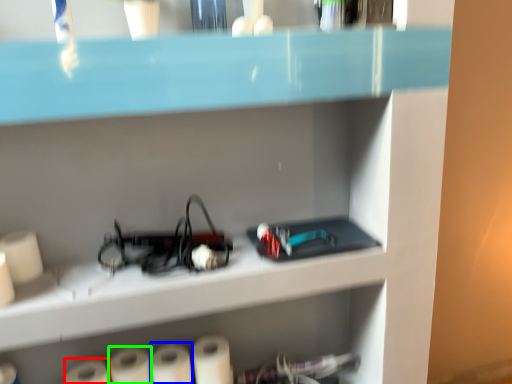
Question: Based on their relative distances, which object is nearer to paper towel (highlighted by a red box)? Choose from paper towel (highlighted by a blue box) and paper towel (highlighted by a green box).

Choices:
 (A) paper towel
 (B) paper towel

Answer: (B)